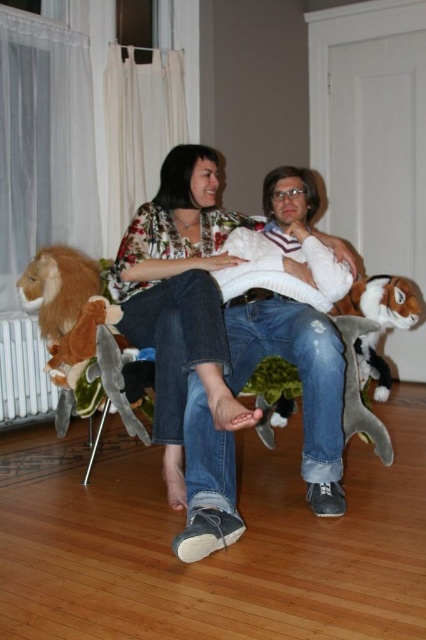
Question: From the image, what is the correct spatial relationship of floral print blouse at center in relation to white metallic radiator at lower left?

Choices:
 (A) below
 (B) above

Answer: (B)

Question: Does floral print blouse at center appear over white metallic radiator at lower left?

Choices:
 (A) no
 (B) yes

Answer: (B)

Question: Among these points, which one is nearest to the camera?

Choices:
 (A) (218, 300)
 (B) (5, 388)

Answer: (A)

Question: Which point is closer to the camera?

Choices:
 (A) (46, 396)
 (B) (138, 257)

Answer: (B)

Question: Where is floral print blouse at center located in relation to white metallic radiator at lower left in the image?

Choices:
 (A) below
 (B) above

Answer: (B)